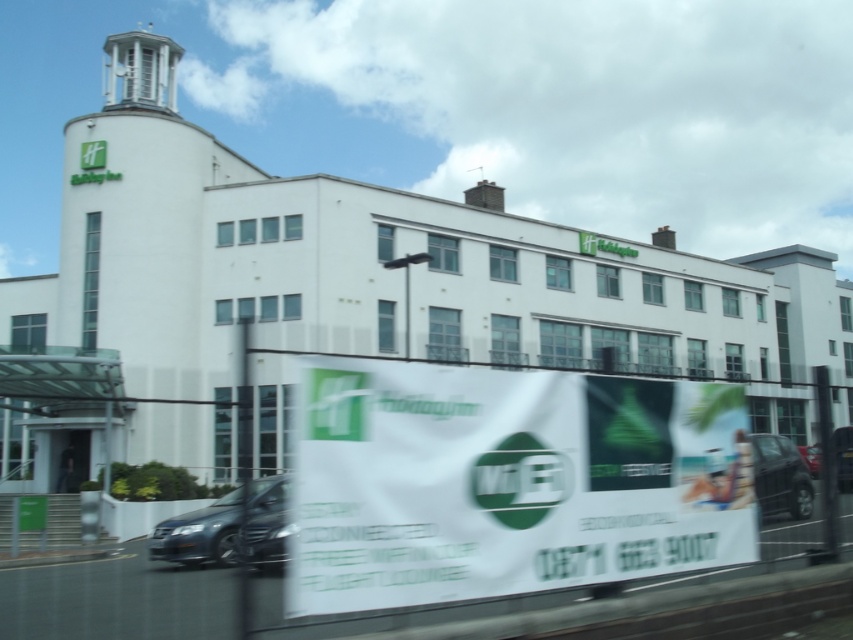
Question: Does shiny metallic car at lower left appear under shiny black car at lower right?

Choices:
 (A) no
 (B) yes

Answer: (B)

Question: Which of the following is the farthest from the observer?

Choices:
 (A) shiny metallic car at lower left
 (B) shiny black car at lower right

Answer: (A)

Question: Based on their relative distances, which object is nearer to the white fabric banner at center?

Choices:
 (A) shiny black car at lower right
 (B) shiny metallic car at lower left

Answer: (A)

Question: Can you confirm if shiny metallic car at lower left is thinner than shiny black car at lower right?

Choices:
 (A) yes
 (B) no

Answer: (B)

Question: Which is farther from the shiny black car at lower right?

Choices:
 (A) white fabric banner at center
 (B) shiny metallic car at lower left

Answer: (B)

Question: Can you confirm if shiny metallic car at lower left is bigger than shiny black car at lower right?

Choices:
 (A) no
 (B) yes

Answer: (B)